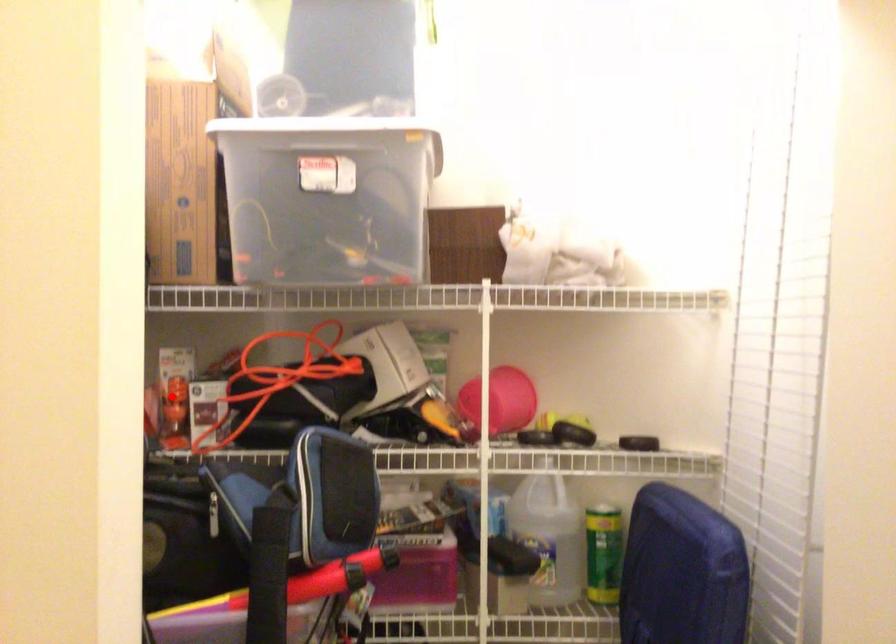
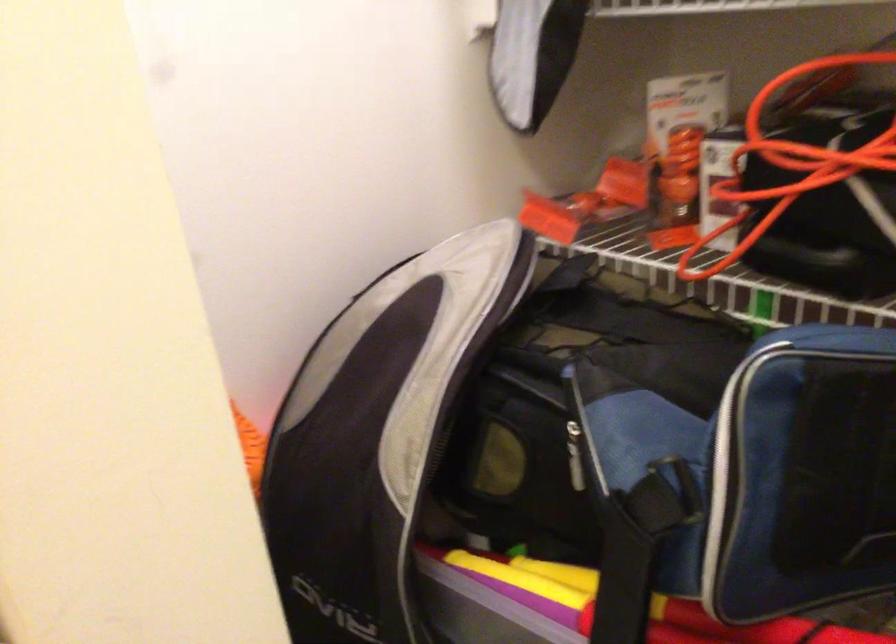
In the second image, find the point that corresponds to the highlighted location in the first image.

(681, 164)